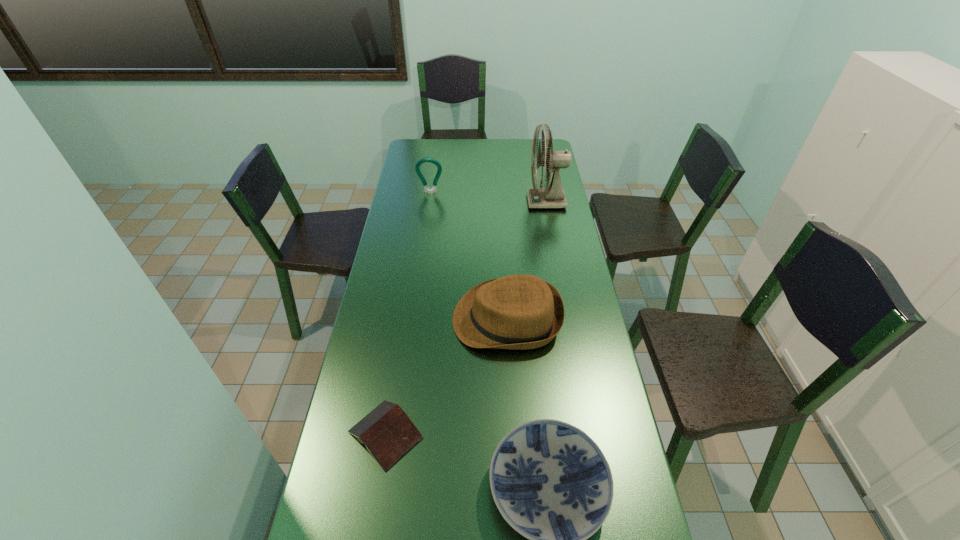
Locate an element on the screen. free space located on the front-facing side of the fedora is located at coordinates (417, 319).

What are the coordinates of `free space located on the front-facing side of the fedora` in the screenshot? It's located at (432, 319).

The height and width of the screenshot is (540, 960). Find the location of `vacant region located on the right of the book`. vacant region located on the right of the book is located at coordinates (443, 435).

What are the coordinates of `bottle opener that is at the left edge` in the screenshot? It's located at (417, 167).

This screenshot has width=960, height=540. What are the coordinates of `book located in the left edge section of the desktop` in the screenshot? It's located at click(x=388, y=433).

You are a GUI agent. You are given a task and a screenshot of the screen. Output one action in this format:
    pyautogui.click(x=<x>, y=<y>)
    Task: Click on the fan at the right edge
    
    Given the screenshot: What is the action you would take?
    pyautogui.click(x=553, y=196)

Image resolution: width=960 pixels, height=540 pixels. In order to click on fedora positioned at the right edge in this screenshot , I will do click(519, 312).

The width and height of the screenshot is (960, 540). I want to click on vacant area at the far edge, so click(x=516, y=142).

In the image, there is a desktop. Identify the location of free region at the left edge. (328, 538).

You are a GUI agent. You are given a task and a screenshot of the screen. Output one action in this format:
    pyautogui.click(x=<x>, y=<y>)
    Task: Click on the free space at the right edge
    The image size is (960, 540).
    Given the screenshot: What is the action you would take?
    pyautogui.click(x=634, y=535)